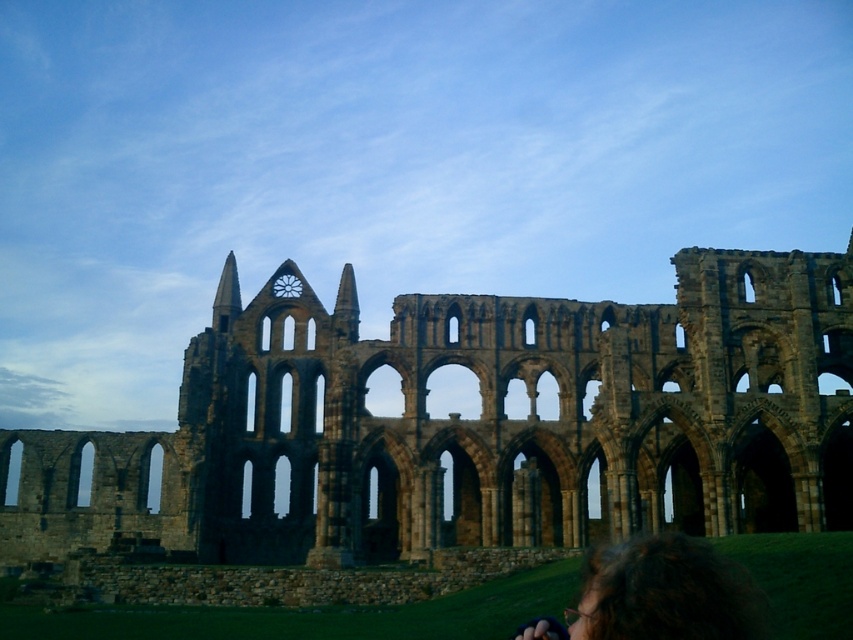
Question: Which of the following is the closest to the observer?

Choices:
 (A) (444, 296)
 (B) (614, 625)

Answer: (B)

Question: Is brown stone ruins at center positioned in front of dark brown hair at lower right?

Choices:
 (A) yes
 (B) no

Answer: (B)

Question: Is brown stone ruins at center further to camera compared to dark brown hair at lower right?

Choices:
 (A) yes
 (B) no

Answer: (A)

Question: Does brown stone ruins at center come behind dark brown hair at lower right?

Choices:
 (A) yes
 (B) no

Answer: (A)